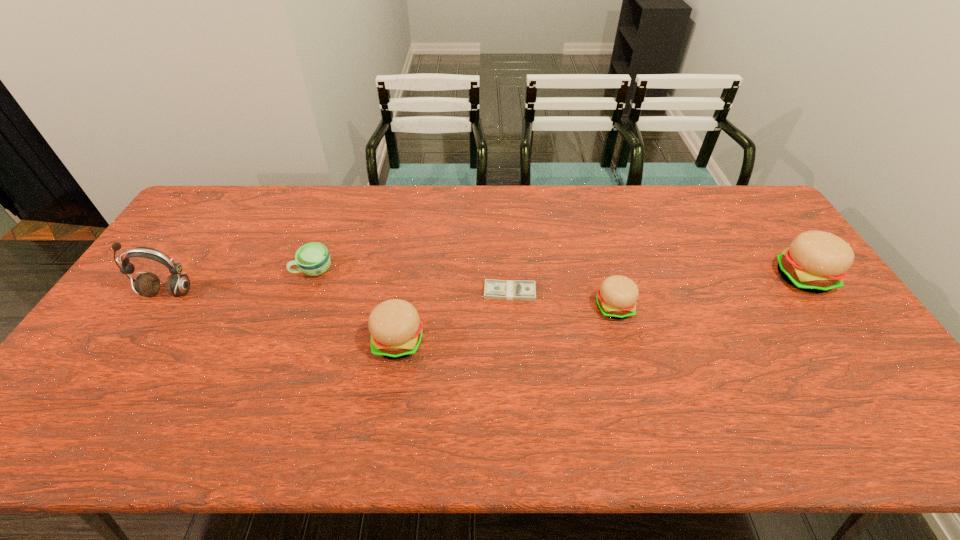
Where is `free space that satisfies the following two spatial constraints: 1. on the front side of the dollar; 2. on the right side of the second object from left to right`? The height and width of the screenshot is (540, 960). free space that satisfies the following two spatial constraints: 1. on the front side of the dollar; 2. on the right side of the second object from left to right is located at coordinates tap(306, 292).

Where is `vacant area that satisfies the following two spatial constraints: 1. on the front side of the shortest hamburger; 2. on the right side of the cup`? vacant area that satisfies the following two spatial constraints: 1. on the front side of the shortest hamburger; 2. on the right side of the cup is located at coordinates point(300,308).

This screenshot has height=540, width=960. Find the location of `free location that satisfies the following two spatial constraints: 1. on the back side of the second shortest hamburger; 2. on the right side of the rightmost hamburger`. free location that satisfies the following two spatial constraints: 1. on the back side of the second shortest hamburger; 2. on the right side of the rightmost hamburger is located at coordinates (409, 278).